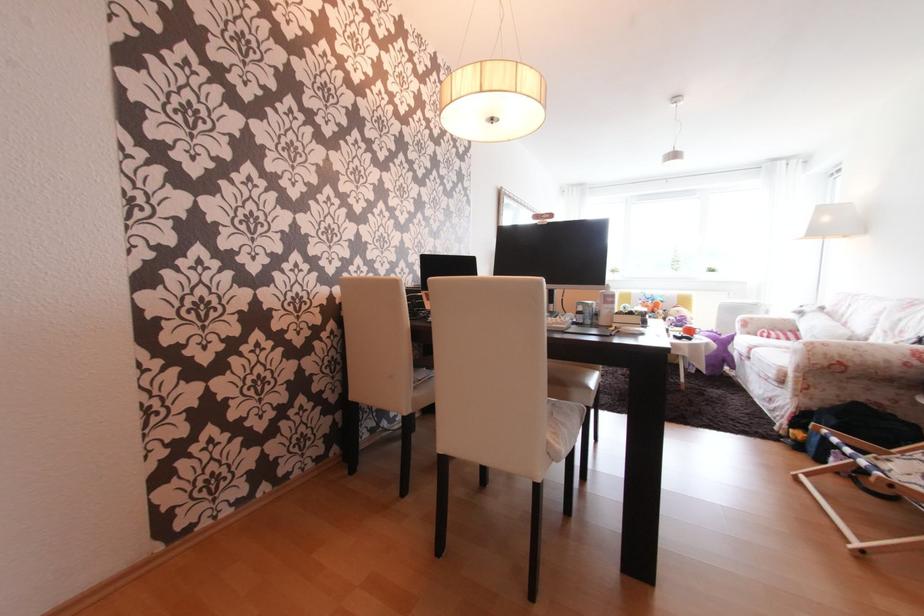
The image size is (924, 616). Describe the element at coordinates (858, 355) in the screenshot. I see `a striped sofa armrest` at that location.